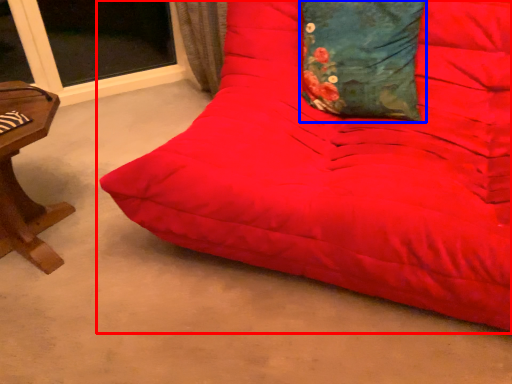
Question: Among these objects, which one is nearest to the camera, studio couch (highlighted by a red box) or pillow (highlighted by a blue box)?

Choices:
 (A) studio couch
 (B) pillow

Answer: (A)